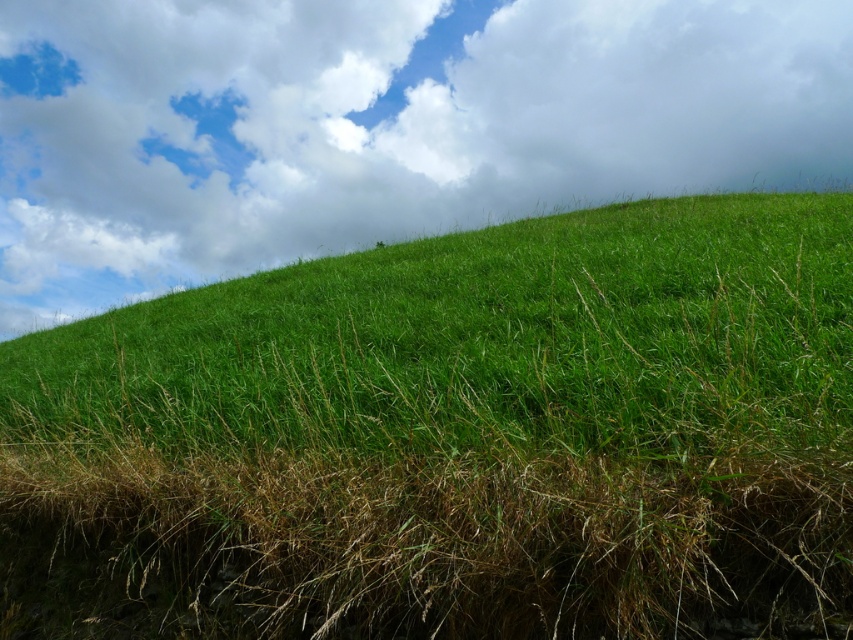
Question: Which of the following is the farthest from the observer?

Choices:
 (A) white fluffy cloud at upper center
 (B) green grassy hill at center

Answer: (A)

Question: Is green grassy hill at center above white fluffy cloud at upper center?

Choices:
 (A) yes
 (B) no

Answer: (B)

Question: Does green grassy hill at center have a greater width compared to white fluffy cloud at upper center?

Choices:
 (A) no
 (B) yes

Answer: (A)

Question: Which point is closer to the camera?

Choices:
 (A) white fluffy cloud at upper center
 (B) green grassy hill at center

Answer: (B)

Question: Can you confirm if green grassy hill at center is positioned above white fluffy cloud at upper center?

Choices:
 (A) yes
 (B) no

Answer: (B)

Question: Which point is farther to the camera?

Choices:
 (A) white fluffy cloud at upper center
 (B) green grassy hill at center

Answer: (A)